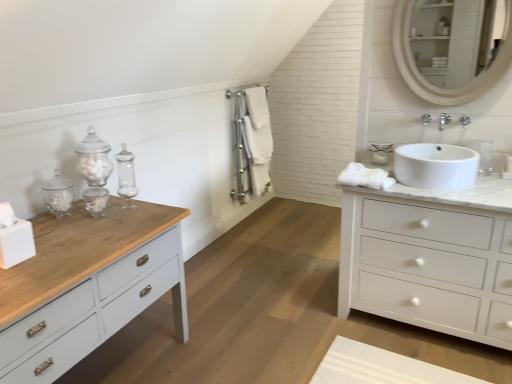
What do you see at coordinates (436, 166) in the screenshot? This screenshot has width=512, height=384. I see `white glossy sink at right` at bounding box center [436, 166].

What do you see at coordinates (257, 138) in the screenshot? The width and height of the screenshot is (512, 384). I see `white cotton bath towel at center, marked as the 1th bath towel in a left-to-right arrangement` at bounding box center [257, 138].

The image size is (512, 384). Find the location of `white fluffy bath towel at right, the third bath towel viewed from the left`. white fluffy bath towel at right, the third bath towel viewed from the left is located at coordinates (365, 177).

Where is `white glossy sink at right`? This screenshot has width=512, height=384. white glossy sink at right is located at coordinates (436, 166).

Is white cotton towel at center, the first bath towel from the back, oriented away from white wooden mirror at upper right?

white cotton towel at center, the first bath towel from the back, is not turned away from white wooden mirror at upper right.

Is white cotton towel at center, the first bath towel from the back, directly adjacent to white wooden mirror at upper right?

No, white cotton towel at center, the first bath towel from the back, is not next to white wooden mirror at upper right.

Is white cotton towel at center, the 2th bath towel in the right-to-left sequence, positioned beyond the bounds of white wooden mirror at upper right?

That's correct, white cotton towel at center, the 2th bath towel in the right-to-left sequence, is outside of white wooden mirror at upper right.

Considering the relative sizes of white cotton towel at center, the 2th bath towel in the right-to-left sequence, and white wooden mirror at upper right in the image provided, is white cotton towel at center, the 2th bath towel in the right-to-left sequence, bigger than white wooden mirror at upper right?

Yes, white cotton towel at center, the 2th bath towel in the right-to-left sequence, is bigger than white wooden mirror at upper right.

Who is taller, white fluffy bath towel at right, which is counted as the 3th bath towel, starting from the back, or white cotton bath towel at center, the third bath towel when ordered from right to left?

white cotton bath towel at center, the third bath towel when ordered from right to left.

You are a GUI agent. You are given a task and a screenshot of the screen. Output one action in this format:
    pyautogui.click(x=<x>, y=<y>)
    Task: Click on the bath towel in front of the white cotton bath towel at center, the third bath towel when ordered from right to left
    Image resolution: width=512 pixels, height=384 pixels.
    Given the screenshot: What is the action you would take?
    pyautogui.click(x=365, y=177)

In the scene shown: Which is closer, (389, 177) or (248, 89)?

Point (389, 177).

Between white fluffy bath towel at right, the third bath towel viewed from the left, and white cotton bath towel at center, marked as the 1th bath towel in a left-to-right arrangement, which one appears on the right side from the viewer's perspective?

Positioned to the right is white fluffy bath towel at right, the third bath towel viewed from the left.

Which object is closer to the camera taking this photo, white cotton towel at center, arranged as the second bath towel when viewed from the left, or white fluffy bath towel at right, which is the 1th bath towel from front to back?

Positioned in front is white fluffy bath towel at right, which is the 1th bath towel from front to back.

From the picture: Considering the relative sizes of white cotton towel at center, the first bath towel from the back, and white fluffy bath towel at right, acting as the 1th bath towel starting from the right, in the image provided, is white cotton towel at center, the first bath towel from the back, thinner than white fluffy bath towel at right, acting as the 1th bath towel starting from the right,?

Indeed, white cotton towel at center, the first bath towel from the back, has a lesser width compared to white fluffy bath towel at right, acting as the 1th bath towel starting from the right.

From a real-world perspective, between white glossy sink at right and white wooden mirror at upper right, who is vertically higher?

From a 3D spatial view, white wooden mirror at upper right is above.

Does white glossy sink at right turn towards white wooden mirror at upper right?

No, white glossy sink at right is not oriented towards white wooden mirror at upper right.

Considering the sizes of objects white glossy sink at right and white wooden mirror at upper right in the image provided, who is thinner, white glossy sink at right or white wooden mirror at upper right?

white wooden mirror at upper right.

Which of these two, white glossy sink at right or white wooden mirror at upper right, stands taller?

With more height is white wooden mirror at upper right.

This screenshot has height=384, width=512. I want to click on sink that appears above the white matte chest of drawers at right (from a real-world perspective), so click(x=436, y=166).

Which object is more forward, white glossy sink at right or white matte chest of drawers at right?

white matte chest of drawers at right.

Considering the points (456, 168) and (429, 211), which point is behind, point (456, 168) or point (429, 211)?

The point (456, 168) is farther.

From the image's perspective, which object appears higher, white glossy sink at right or white matte chest of drawers at right?

white glossy sink at right is shown above in the image.

How different are the orientations of white glossy sink at right and white cotton bath towel at center, marked as the 1th bath towel in a left-to-right arrangement, in degrees?

There is a 91.5-degree angle between the facing directions of white glossy sink at right and white cotton bath towel at center, marked as the 1th bath towel in a left-to-right arrangement.

Is white glossy sink at right inside the boundaries of white cotton bath towel at center, marked as the 1th bath towel in a left-to-right arrangement, or outside?

white glossy sink at right is spatially situated outside white cotton bath towel at center, marked as the 1th bath towel in a left-to-right arrangement.

Is white glossy sink at right far away from white cotton bath towel at center, which appears as the 2th bath towel when viewed from the back?

Yes, white glossy sink at right is far from white cotton bath towel at center, which appears as the 2th bath towel when viewed from the back.

From a real-world perspective, does white glossy sink at right stand above white cotton bath towel at center, which appears as the 2th bath towel when viewed from the back?

Indeed, from a real-world perspective, white glossy sink at right stands above white cotton bath towel at center, which appears as the 2th bath towel when viewed from the back.

From a real-world perspective, is white fluffy bath towel at right, the third bath towel viewed from the left, beneath white wooden mirror at upper right?

Indeed, from a real-world perspective, white fluffy bath towel at right, the third bath towel viewed from the left, is positioned beneath white wooden mirror at upper right.

Considering the relative sizes of white fluffy bath towel at right, which is counted as the 3th bath towel, starting from the back, and white wooden mirror at upper right in the image provided, is white fluffy bath towel at right, which is counted as the 3th bath towel, starting from the back, wider than white wooden mirror at upper right?

Yes.

Is white fluffy bath towel at right, which is the 1th bath towel from front to back, to the left of white wooden mirror at upper right from the viewer's perspective?

Indeed, white fluffy bath towel at right, which is the 1th bath towel from front to back, is positioned on the left side of white wooden mirror at upper right.

Locate an element on the screen. This screenshot has width=512, height=384. the 1st bath towel positioned below the white wooden mirror at upper right (from a real-world perspective) is located at coordinates (257, 106).

Locate an element on the screen. This screenshot has width=512, height=384. bath towel that is the 1st one when counting upward from the white fluffy bath towel at right, which is counted as the 3th bath towel, starting from the back (from the image's perspective) is located at coordinates (257, 138).

Considering their positions, is white cotton towel at center, arranged as the second bath towel when viewed from the left, positioned closer to white wooden mirror at upper right than white cotton bath towel at center, marked as the 1th bath towel in a left-to-right arrangement?

white cotton towel at center, arranged as the second bath towel when viewed from the left.

Looking at the image, which one is located further to white fluffy bath towel at right, the third bath towel viewed from the left, white cotton towel at center, the 2th bath towel in the right-to-left sequence, or white glossy sink at right?

white cotton towel at center, the 2th bath towel in the right-to-left sequence, is positioned further to the anchor white fluffy bath towel at right, the third bath towel viewed from the left.

Looking at the image, which one is located further to white cotton towel at center, the first bath towel from the back, white matte chest of drawers at right or white cotton bath towel at center, the 2th bath towel from the front?

white matte chest of drawers at right lies further to white cotton towel at center, the first bath towel from the back, than the other object.

Which object lies nearer to the anchor point white glossy sink at right, white matte chest of drawers at right or white cotton bath towel at center, the 2th bath towel from the front?

white matte chest of drawers at right.

Which object lies further to the anchor point white cotton bath towel at center, the 2th bath towel from the front, white wooden mirror at upper right or white cotton towel at center, the 2th bath towel in the right-to-left sequence?

white wooden mirror at upper right lies further to white cotton bath towel at center, the 2th bath towel from the front, than the other object.

Estimate the real-world distances between objects in this image. Which object is further from white matte chest of drawers at right, white fluffy bath towel at right, acting as the 1th bath towel starting from the right, or white cotton bath towel at center, which appears as the 2th bath towel when viewed from the back?

Based on the image, white cotton bath towel at center, which appears as the 2th bath towel when viewed from the back, appears to be further to white matte chest of drawers at right.

Estimate the real-world distances between objects in this image. Which object is closer to white cotton towel at center, the 2th bath towel in the right-to-left sequence, white wooden mirror at upper right or white cotton bath towel at center, marked as the 1th bath towel in a left-to-right arrangement?

white cotton bath towel at center, marked as the 1th bath towel in a left-to-right arrangement.

Based on the photo, considering their positions, is white glossy sink at right positioned further to white cotton bath towel at center, marked as the 1th bath towel in a left-to-right arrangement, than white matte chest of drawers at right?

Among the two, white matte chest of drawers at right is located further to white cotton bath towel at center, marked as the 1th bath towel in a left-to-right arrangement.

This screenshot has height=384, width=512. Find the location of `sink between white matte chest of drawers at right and white cotton bath towel at center, the third bath towel when ordered from right to left, along the z-axis`. sink between white matte chest of drawers at right and white cotton bath towel at center, the third bath towel when ordered from right to left, along the z-axis is located at coordinates (436, 166).

Find the location of a particular element. sink that lies between white wooden mirror at upper right and white fluffy bath towel at right, acting as the 1th bath towel starting from the right, from top to bottom is located at coordinates (436, 166).

At what (x,y) coordinates should I click in order to perform the action: click on bath towel between white glossy sink at right and white matte chest of drawers at right in the vertical direction. Please return your answer as a coordinate pair (x, y). Looking at the image, I should click on (365, 177).

This screenshot has width=512, height=384. I want to click on mirror positioned between white matte chest of drawers at right and white cotton bath towel at center, which appears as the 2th bath towel when viewed from the back, from near to far, so click(x=450, y=40).